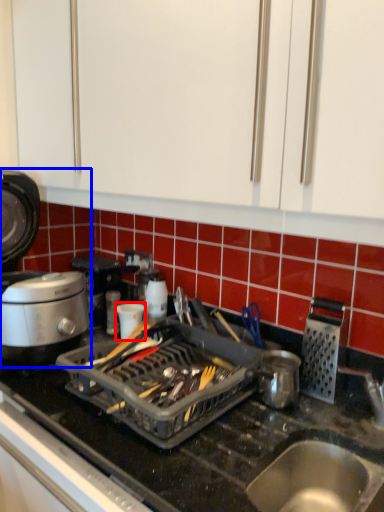
Question: Which object is further to the camera taking this photo, kitchen appliance (highlighted by a red box) or kitchen appliance (highlighted by a blue box)?

Choices:
 (A) kitchen appliance
 (B) kitchen appliance

Answer: (A)